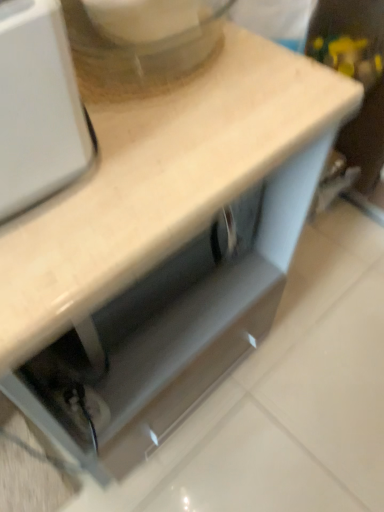
Question: Should I look upward or downward to see white matte countertop at upper center?

Choices:
 (A) down
 (B) up

Answer: (A)

Question: Considering the relative sizes of white matte countertop at upper center and white plastic mixer at upper left in the image provided, is white matte countertop at upper center taller than white plastic mixer at upper left?

Choices:
 (A) yes
 (B) no

Answer: (A)

Question: Is white matte countertop at upper center at the right side of white plastic mixer at upper left?

Choices:
 (A) yes
 (B) no

Answer: (B)

Question: From a real-world perspective, is white matte countertop at upper center physically above white plastic mixer at upper left?

Choices:
 (A) yes
 (B) no

Answer: (B)

Question: From the image's perspective, is white matte countertop at upper center under white plastic mixer at upper left?

Choices:
 (A) no
 (B) yes

Answer: (B)

Question: Is white plastic mixer at upper left a part of white matte countertop at upper center?

Choices:
 (A) yes
 (B) no

Answer: (B)

Question: Is white matte countertop at upper center oriented towards white plastic mixer at upper left?

Choices:
 (A) yes
 (B) no

Answer: (B)

Question: Can you confirm if white plastic mixer at upper left is shorter than white matte countertop at upper center?

Choices:
 (A) yes
 (B) no

Answer: (A)

Question: Does white plastic mixer at upper left lie behind white matte countertop at upper center?

Choices:
 (A) yes
 (B) no

Answer: (A)

Question: From a real-world perspective, is white plastic mixer at upper left located higher than white matte countertop at upper center?

Choices:
 (A) yes
 (B) no

Answer: (A)

Question: From the image's perspective, is white plastic mixer at upper left on white matte countertop at upper center?

Choices:
 (A) yes
 (B) no

Answer: (A)

Question: Are white plastic mixer at upper left and white matte countertop at upper center beside each other?

Choices:
 (A) no
 (B) yes

Answer: (A)

Question: Is the position of white plastic mixer at upper left less distant than that of white matte countertop at upper center?

Choices:
 (A) yes
 (B) no

Answer: (B)

Question: In terms of height, does white plastic mixer at upper left look taller or shorter compared to white matte countertop at upper center?

Choices:
 (A) short
 (B) tall

Answer: (A)